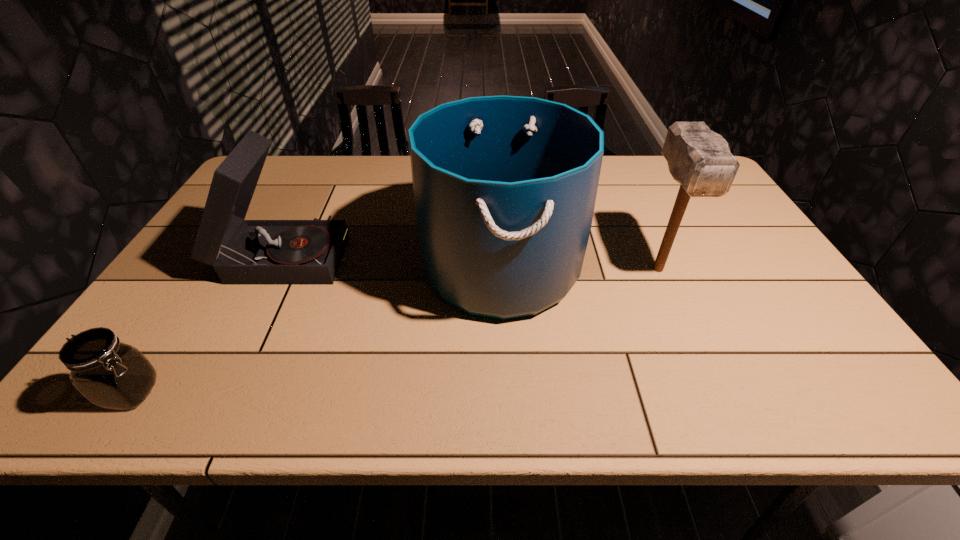
Locate an element on the screen. The height and width of the screenshot is (540, 960). the second object from right to left is located at coordinates (504, 187).

Where is `mallet`? The height and width of the screenshot is (540, 960). mallet is located at coordinates (699, 159).

Locate an element on the screen. This screenshot has height=540, width=960. phonograph_record is located at coordinates (243, 252).

This screenshot has width=960, height=540. I want to click on the shortest object, so click(112, 375).

Where is `jar`? jar is located at coordinates (112, 375).

I want to click on vacant space situated 0.280m on the right of the third object from left to right, so click(x=685, y=266).

This screenshot has width=960, height=540. In order to click on free region located 0.210m on the striking face of the rightmost object in this screenshot , I will do `click(700, 364)`.

In order to click on free location located 0.230m on the front-facing side of the phonograph_record in this screenshot , I will do `click(429, 254)`.

Image resolution: width=960 pixels, height=540 pixels. I want to click on vacant space located on the lid of the shortest object, so click(x=329, y=393).

I want to click on object present at the near edge, so click(x=112, y=375).